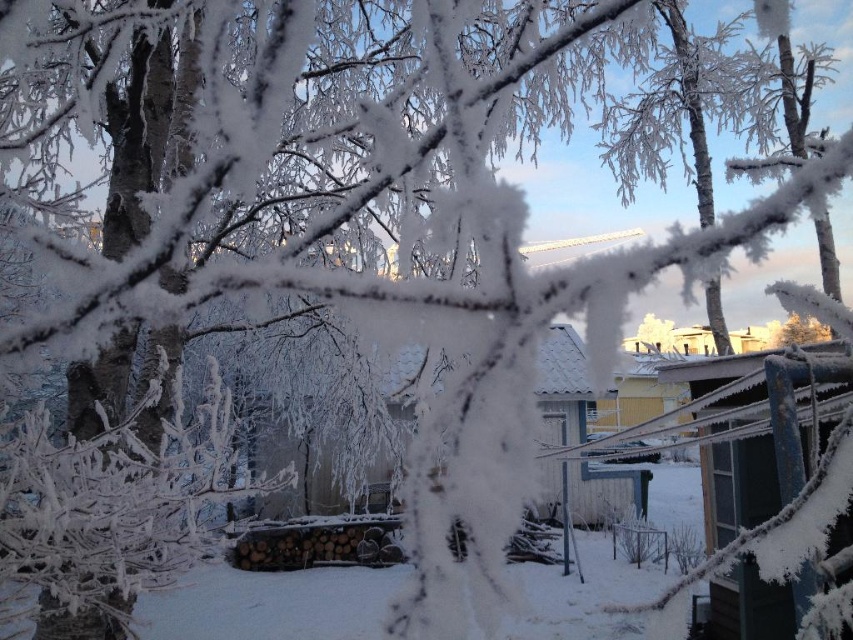
You are an explorer in a snowy landscape with a sled that requires 5 meters of space to stop safely. You need to stop your sled between the blue painted wood hut at right and the white wooden hut at center. Is there enough space between them for your sled to stop safely?

The distance between the blue painted wood hut at right and the white wooden hut at center is 5.36 meters. Since your sled needs 5 meters to stop safely, there is sufficient space between them for your sled to stop safely.

In the scene shown: You are an architect designing a winter landscape and want to place a new treehouse between the blue painted wood hut at right and the white wooden hut at center. Which hut should the treehouse be closer to if you want it to be taller than both?

The treehouse should be closer to the white wooden hut at center because the blue painted wood hut at right is not as tall as the white wooden hut at center, so the treehouse can be positioned near the taller white wooden hut at center to exceed both heights.

You are standing at the center of the winter scene and want to reach the blue painted wood hut at right. According to the coordinates provided, in which direction should you move to get there?

The blue painted wood hut at right is located at coordinates point (744, 442), which means it is positioned to the right and slightly forward from your current position at the center. You should move towards the right and slightly forward to reach it.